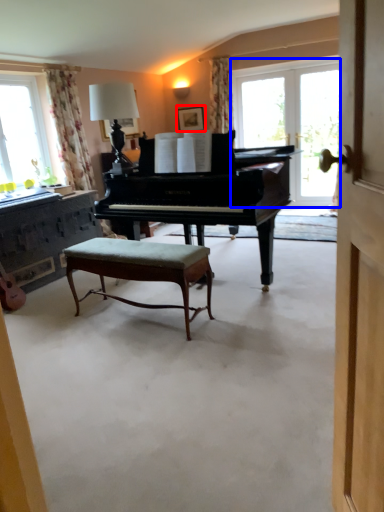
Question: Which object is further to the camera taking this photo, picture frame (highlighted by a red box) or window screen (highlighted by a blue box)?

Choices:
 (A) picture frame
 (B) window screen

Answer: (A)